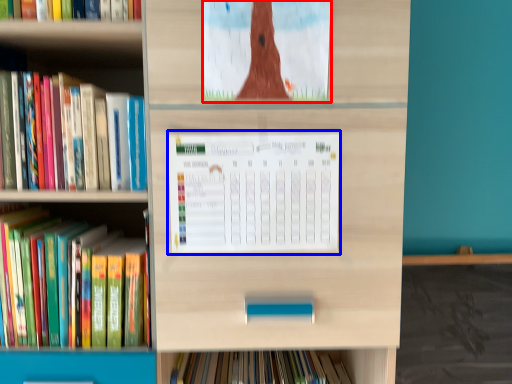
Question: Which object appears closest to the camera in this image, book cover (highlighted by a red box) or paperback book (highlighted by a blue box)?

Choices:
 (A) book cover
 (B) paperback book

Answer: (A)